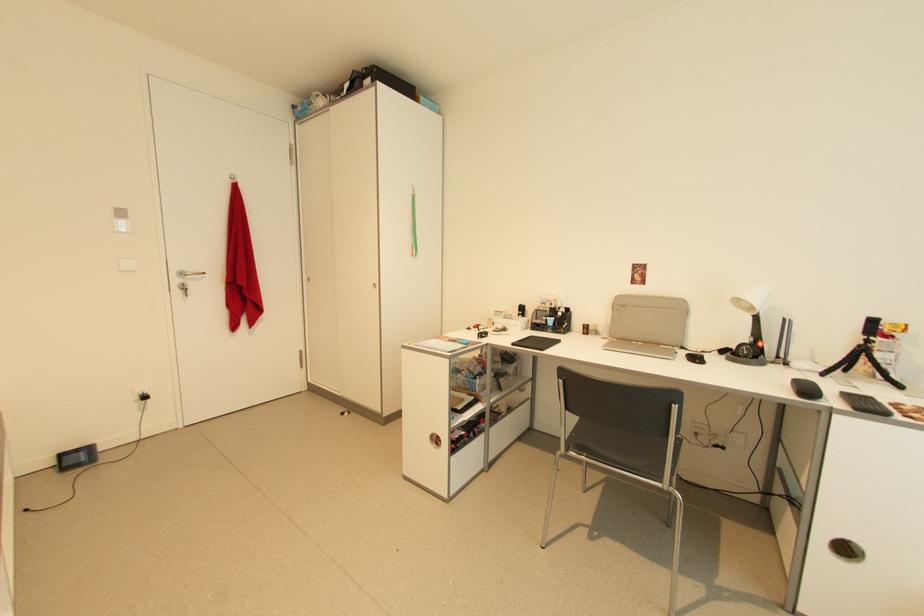
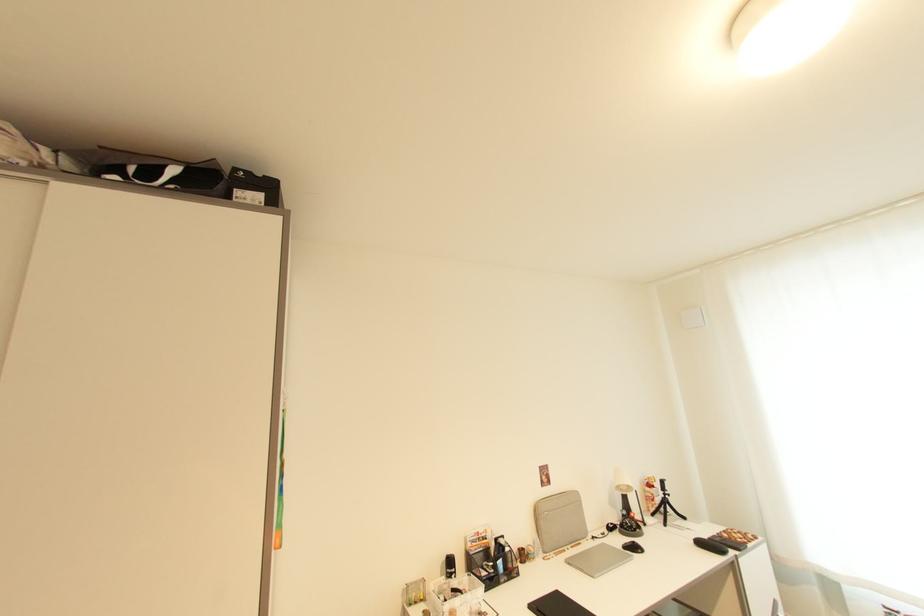
Where in the second image is the point corresponding to point 868,345 from the first image?

(669, 498)